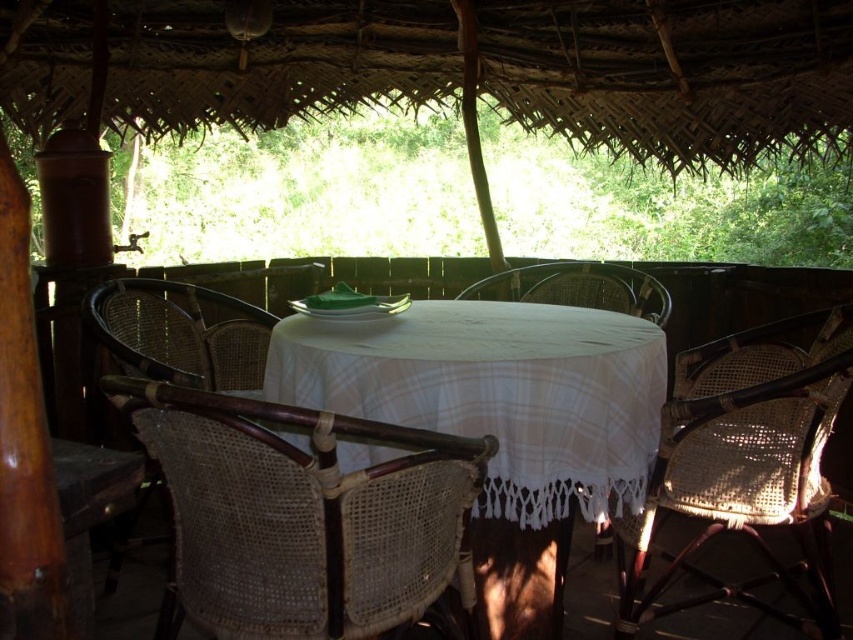
Can you confirm if woven cane chair at lower right is positioned below woven rattan chair at center?

Indeed, woven cane chair at lower right is positioned under woven rattan chair at center.

How far apart are woven cane chair at lower right and woven rattan chair at center?

woven cane chair at lower right is 83.46 centimeters away from woven rattan chair at center.

Where is `woven cane chair at lower right`? The image size is (853, 640). woven cane chair at lower right is located at coordinates (746, 464).

Does white woven tablecloth at center appear over woven rattan chair at left?

Actually, white woven tablecloth at center is below woven rattan chair at left.

Does point (659, 362) come in front of point (96, 291)?

Yes.

Identify the location of white woven tablecloth at center. This screenshot has height=640, width=853. (496, 392).

Who is higher up, woven cane chair at center or white woven tablecloth at center?

Positioned higher is white woven tablecloth at center.

In the scene shown: Does woven cane chair at center have a lesser height compared to white woven tablecloth at center?

Correct, woven cane chair at center is not as tall as white woven tablecloth at center.

Identify the location of woven cane chair at center. The height and width of the screenshot is (640, 853). (300, 515).